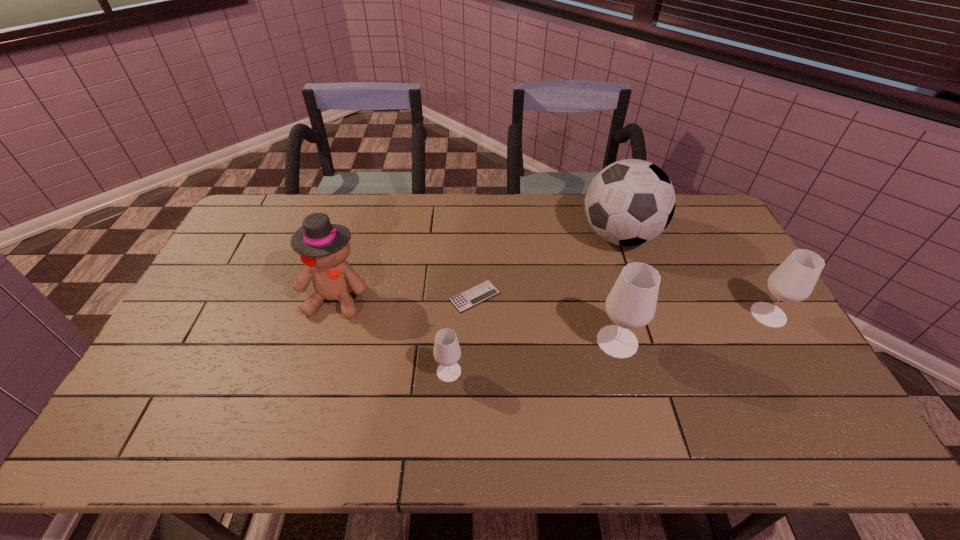
Locate an element on the screen. The width and height of the screenshot is (960, 540). the nearest object is located at coordinates (447, 352).

The width and height of the screenshot is (960, 540). What are the coordinates of `the shortest glass` in the screenshot? It's located at (447, 352).

Identify the location of the second glass from left to right. (631, 304).

What are the coordinates of `the third shortest object` in the screenshot? It's located at (793, 281).

Locate an element on the screen. The width and height of the screenshot is (960, 540). the second shortest glass is located at coordinates (793, 281).

Identify the location of the leftmost object. The width and height of the screenshot is (960, 540). (323, 247).

Find the location of a particular element. This screenshot has height=540, width=960. soccer ball is located at coordinates click(x=630, y=202).

What are the coordinates of `calculator` in the screenshot? It's located at (486, 290).

Find the location of `free location located 0.340m on the left of the nearest glass`. free location located 0.340m on the left of the nearest glass is located at coordinates (306, 372).

Image resolution: width=960 pixels, height=540 pixels. I want to click on free spot located on the back of the second glass from right to left, so click(x=606, y=298).